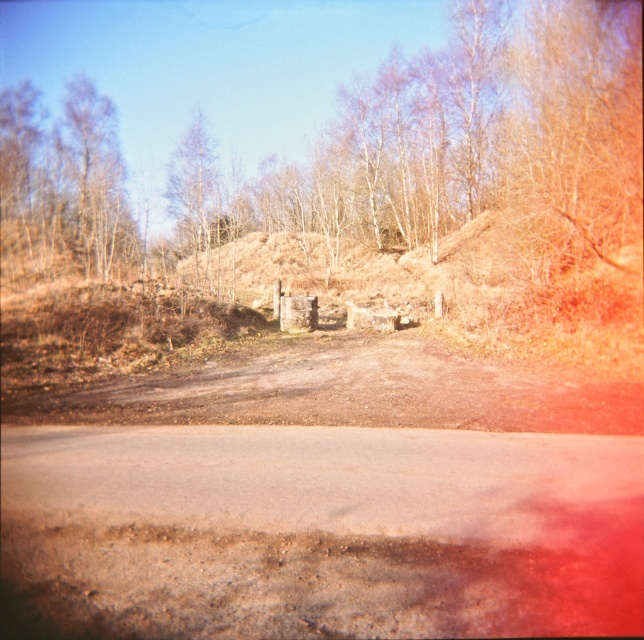
Who is taller, dull gray asphalt at center or brown textured tree at upper center?

With more height is brown textured tree at upper center.

Is dull gray asphalt at center shorter than brown textured tree at upper center?

Yes, dull gray asphalt at center is shorter than brown textured tree at upper center.

Locate an element on the screen. Image resolution: width=644 pixels, height=640 pixels. dull gray asphalt at center is located at coordinates (328, 529).

The image size is (644, 640). I want to click on dull gray asphalt at center, so click(328, 529).